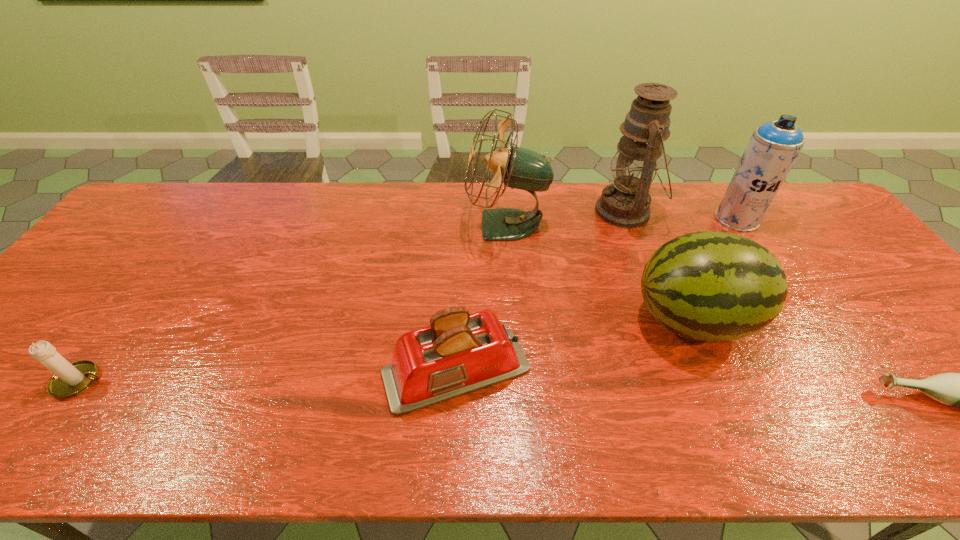
At what (x,y) coordinates should I click in order to perform the action: click on blank region between the fourth tallest object and the fan. Please return your answer as a coordinate pair (x, y). The width and height of the screenshot is (960, 540). Looking at the image, I should click on (600, 273).

Where is `empty location between the candle holder and the oil lamp`? empty location between the candle holder and the oil lamp is located at coordinates (353, 296).

Identify the location of empty space that is in between the second shortest object and the oil lamp. Image resolution: width=960 pixels, height=540 pixels. (353, 296).

Find the location of a particular element. The image size is (960, 540). blank region between the toaster and the watermelon is located at coordinates (574, 346).

Identify which object is the fourth nearest to the fifth tallest object. Please provide its 2D coordinates. Your answer should be formatted as a tuple, i.e. [(x, y)], where the tuple contains the x and y coordinates of a point satisfying the conditions above.

[(69, 380)]

Point out which object is positioned as the second nearest to the shortest object. Please provide its 2D coordinates. Your answer should be formatted as a tuple, i.e. [(x, y)], where the tuple contains the x and y coordinates of a point satisfying the conditions above.

[(774, 146)]

In order to click on free spot that satisfies the following two spatial constraints: 1. on the front side of the oil lamp; 2. on the left side of the aerosol can in this screenshot , I will do `click(628, 219)`.